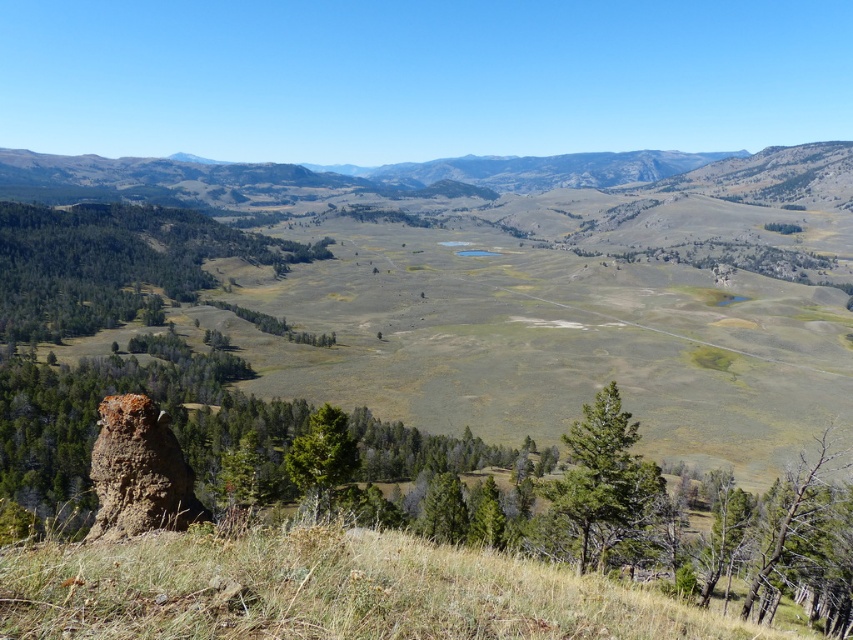
You are standing on the grassy hillside and want to place a small marker between the dry grass at lower left and the brown rough rock at lower left. According to the scene description, which object should the marker be closer to?

The dry grass at lower left is positioned on the right side of brown rough rock at lower left, so the marker should be placed closer to the brown rough rock at lower left to be between them.

You are an environmental scientist assessing the terrain. You need to determine which area has more surface coverage between the dry grass at lower left and the brown rough rock at lower left. Based on the scene, which one covers a larger area?

The dry grass at lower left covers a larger area than the brown rough rock at lower left, as it is described as being larger in size.

You are a hiker standing on the grassy hillside and want to cross to the other side. You notice dry grass at lower left and brown rough rock at lower left. Which one should you avoid stepping on if you want to stay above the ground level?

You should avoid stepping on the dry grass at lower left because it is taller than the brown rough rock at lower left, meaning the rock is lower and stepping on the grass would keep you higher.